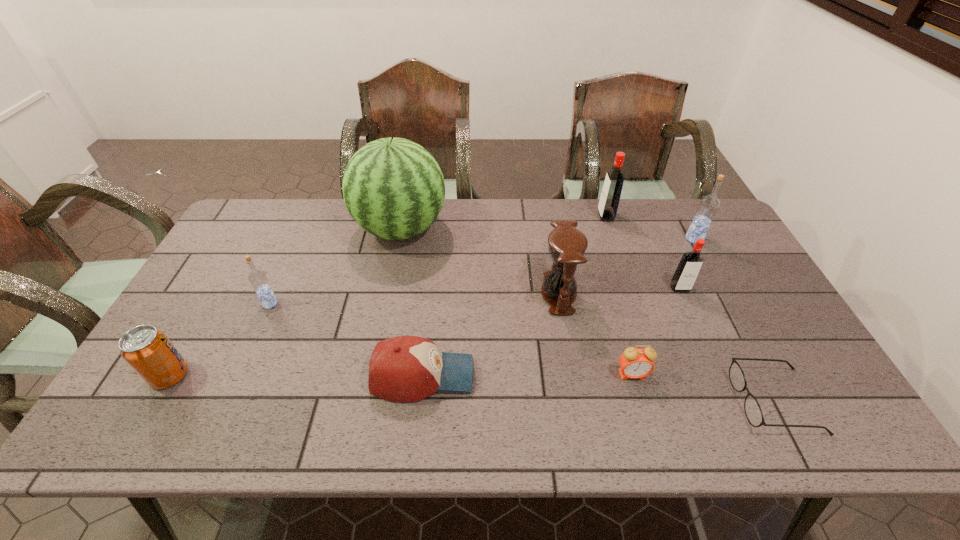
Image resolution: width=960 pixels, height=540 pixels. What are the coordinates of `vacant region between the brown hourglass and the green watermelon` in the screenshot? It's located at (480, 261).

Locate an element on the screen. unoccupied area between the alarm clock and the sixth object from right to left is located at coordinates (595, 334).

The image size is (960, 540). In order to click on vacant region between the tallest object and the baseball cap in this screenshot , I will do `click(412, 302)`.

Locate an element on the screen. This screenshot has height=540, width=960. free spot between the hourglass and the pink alarm clock is located at coordinates (595, 334).

Identify the location of free point between the leftmost object and the fourth object from right to left. (388, 295).

Locate an element on the screen. This screenshot has width=960, height=540. object identified as the second closest to the baseball cap is located at coordinates (258, 279).

Locate an element on the screen. The height and width of the screenshot is (540, 960). the fifth closest object relative to the spectacles is located at coordinates (609, 200).

Find the location of a particular element. the second closest vodka to the bigger red vodka is located at coordinates (690, 264).

I want to click on vodka that stands as the fourth closest to the brown hourglass, so click(258, 279).

What are the coordinates of `free point that satisfies the following two spatial constraints: 1. on the front side of the sixth object from right to left; 2. on the front-facing side of the red baseball cap` in the screenshot? It's located at (572, 375).